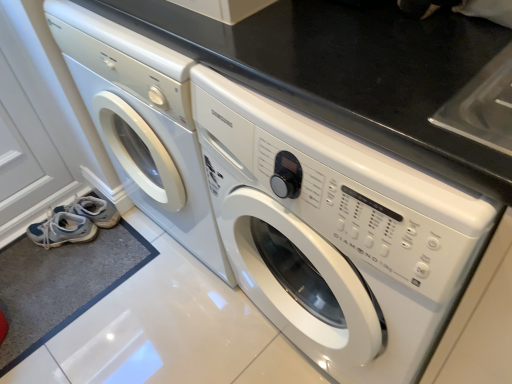
Question: Is white glossy washing machine at center, the second washing machine viewed from the right, wider or thinner than light blue fabric shoe at lower left, the 2th shoe viewed from the top?

Choices:
 (A) wide
 (B) thin

Answer: (A)

Question: From a real-world perspective, is white glossy washing machine at center, the second washing machine viewed from the right, positioned above or below light blue fabric shoe at lower left, the 2th shoe viewed from the top?

Choices:
 (A) above
 (B) below

Answer: (A)

Question: Which object is positioned closest to the white glossy washing machine at center, the 1th washing machine positioned from the right?

Choices:
 (A) white glossy washing machine at center, which ranks as the first washing machine in left-to-right order
 (B) white fabric shoe at lower left, which is the 2th shoe in bottom-to-top order
 (C) light blue fabric shoe at lower left, the 2th shoe viewed from the top

Answer: (A)

Question: Estimate the real-world distances between objects in this image. Which object is closer to the white glossy washing machine at center, the second washing machine viewed from the right?

Choices:
 (A) white fabric shoe at lower left, the 1th shoe from the top
 (B) white glossy washing machine at center, acting as the 2th washing machine starting from the left
 (C) light blue fabric shoe at lower left, the 2th shoe viewed from the top

Answer: (B)